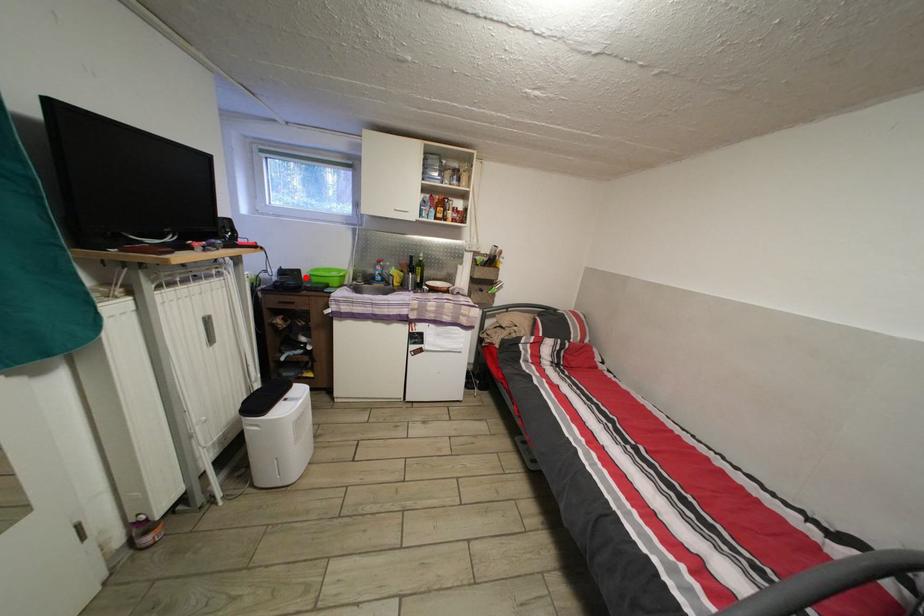
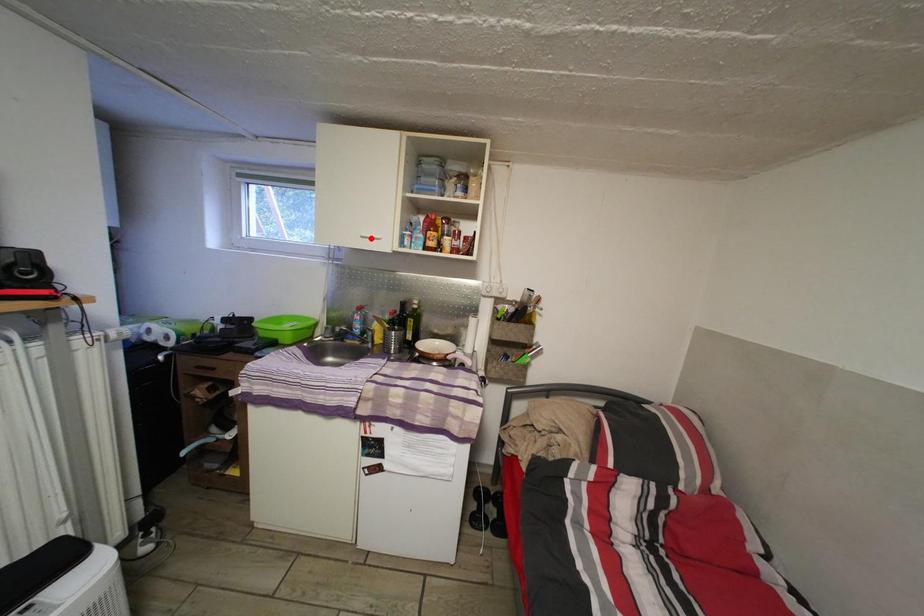
I am providing you with two images of the same scene from different viewpoints. A red point is marked on the first image and another point is marked on the second image. Is the marked point in image1 the same physical position as the marked point in image2?

No